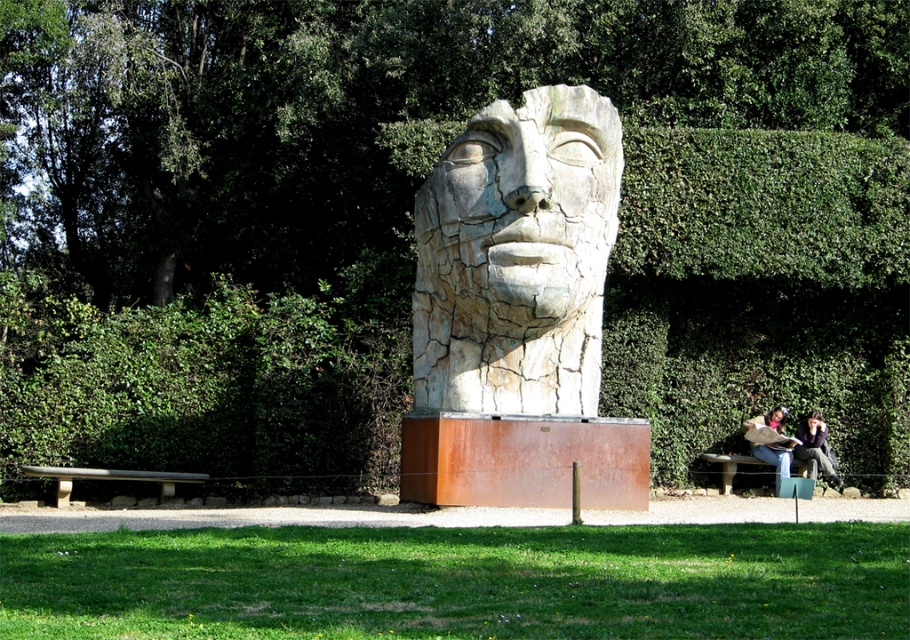
Between matte brown bench at lower right and rustic wood bench at lower right, which one appears on the right side from the viewer's perspective?

matte brown bench at lower right is more to the right.

What do you see at coordinates (787, 445) in the screenshot? I see `matte brown bench at lower right` at bounding box center [787, 445].

Is point (766, 449) positioned in front of point (723, 480)?

Yes, point (766, 449) is in front of point (723, 480).

Identify the location of matte brown bench at lower right. (787, 445).

Between cracked stone head at center and rustic metal bench at lower left, which one has less height?

Standing shorter between the two is rustic metal bench at lower left.

The height and width of the screenshot is (640, 910). I want to click on cracked stone head at center, so (518, 312).

Where is `cracked stone head at center`? Image resolution: width=910 pixels, height=640 pixels. cracked stone head at center is located at coordinates (518, 312).

Does point (433, 268) come closer to viewer compared to point (787, 460)?

That is True.

Between point (452, 253) and point (814, 444), which one is positioned in front?

Positioned in front is point (452, 253).

The height and width of the screenshot is (640, 910). What are the coordinates of `cracked stone face at center` in the screenshot? It's located at (519, 216).